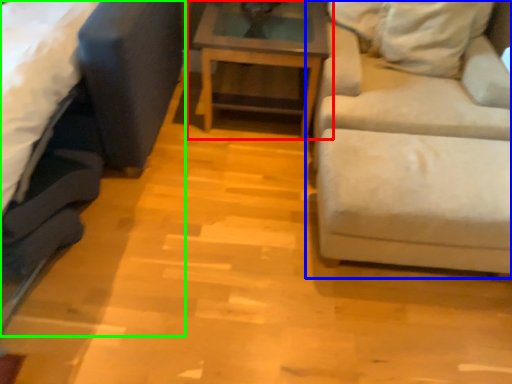
Question: Which object is positioned farthest from table (highlighted by a red box)? Select from studio couch (highlighted by a blue box) and studio couch (highlighted by a green box).

Choices:
 (A) studio couch
 (B) studio couch

Answer: (B)